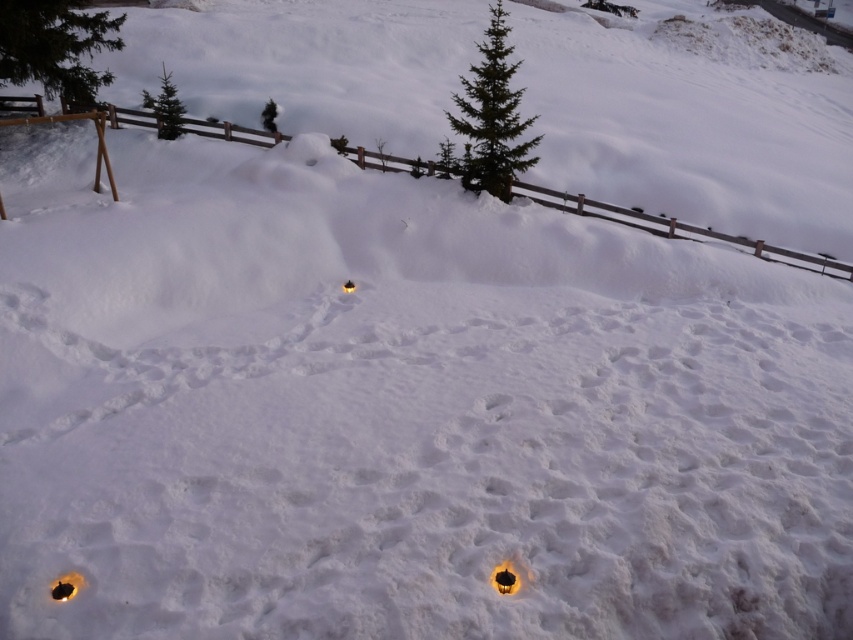
You are an explorer in the snowy landscape and want to reach the cluster of glowing lights. You notice two trees ahead of you, the green textured pine tree at upper left and the green matte tree at upper center. Which tree is closer to you as you head towards the lights?

The green textured pine tree at upper left is closer to the viewer than the green matte tree at upper center, so the green textured pine tree at upper left is closer to you as you head towards the lights.

You are standing at the origin point of the coordinate system, which is the bottom left corner of the image. The coordinate system has a maximum x value of 1.0 and a maximum y value of 1.0. You want to walk towards the brown wooden fence at upper center. In which direction should you move relative to your current position?

Since the brown wooden fence at upper center is located at coordinate point 0.358 on the x axis and 0.794 on the y axis, you should move northeast to reach it.

You are an explorer in a snowy area and see the green textured pine tree at upper left and the green matte tree at upper left. Which tree is closer to you?

The green textured pine tree at upper left is smaller than the green matte tree at upper left, so the green textured pine tree at upper left is closer to you because smaller objects appear closer in perspective.